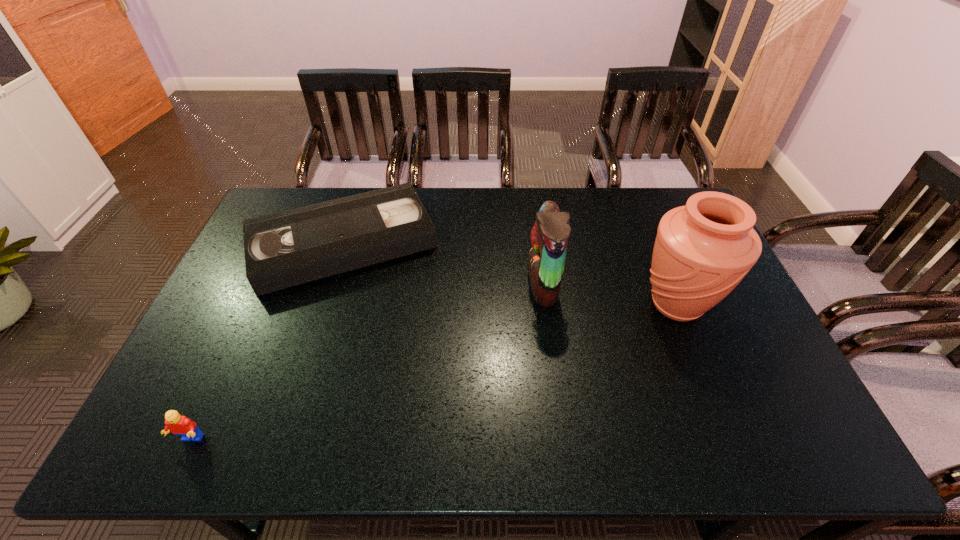
In the image, there is a desktop. At what (x,y) coordinates should I click in order to perform the action: click on vacant space at the near edge. Please return your answer as a coordinate pair (x, y). Looking at the image, I should click on (726, 455).

Where is `free space at the left edge`? The width and height of the screenshot is (960, 540). free space at the left edge is located at coordinates click(206, 367).

In the image, there is a desktop. Identify the location of vacant space at the right edge. The image size is (960, 540). (767, 395).

What are the coordinates of `free point between the vase and the nearest object` in the screenshot? It's located at (433, 372).

The width and height of the screenshot is (960, 540). What are the coordinates of `vacant area that lies between the second object from right to left and the shortest object` in the screenshot? It's located at (444, 264).

What are the coordinates of `vacant space that is in between the nearest object and the third shortest object` in the screenshot? It's located at (367, 362).

The height and width of the screenshot is (540, 960). Identify the location of unoccupied position between the third shortest object and the rightmost object. (610, 294).

Identify the location of free space between the tallest object and the nearest object. This screenshot has width=960, height=540. click(433, 372).

Image resolution: width=960 pixels, height=540 pixels. Find the location of `vacant region between the shortest object and the second shortest object`. vacant region between the shortest object and the second shortest object is located at coordinates (267, 341).

This screenshot has width=960, height=540. I want to click on vacant area that lies between the nearest object and the tallest object, so click(433, 372).